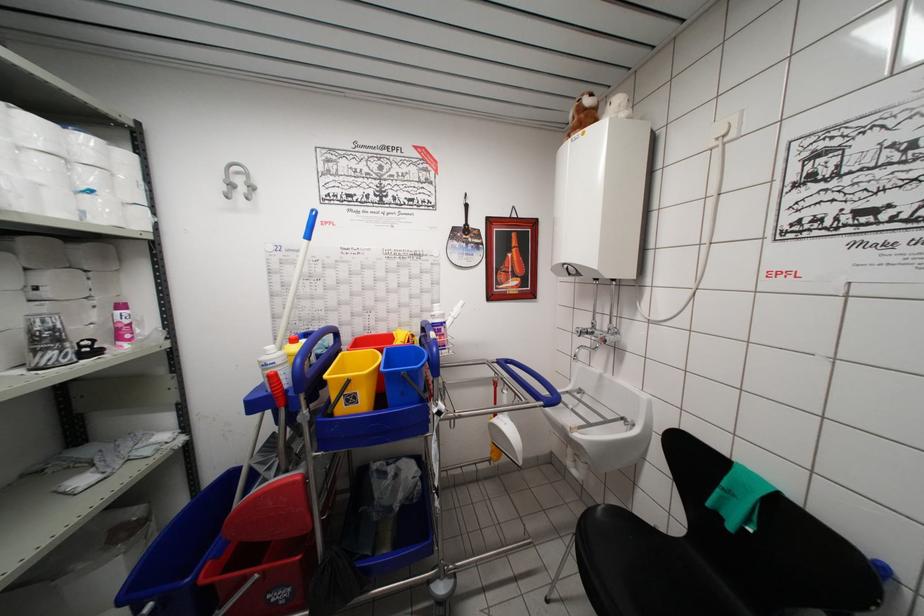
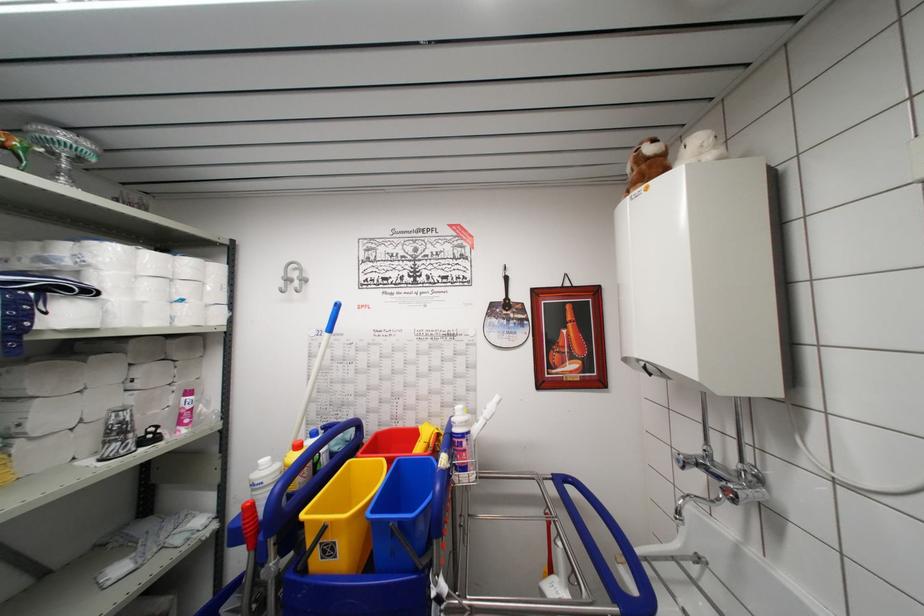
The point at (92, 182) is marked in the first image. Where is the corresponding point in the second image?

(188, 294)